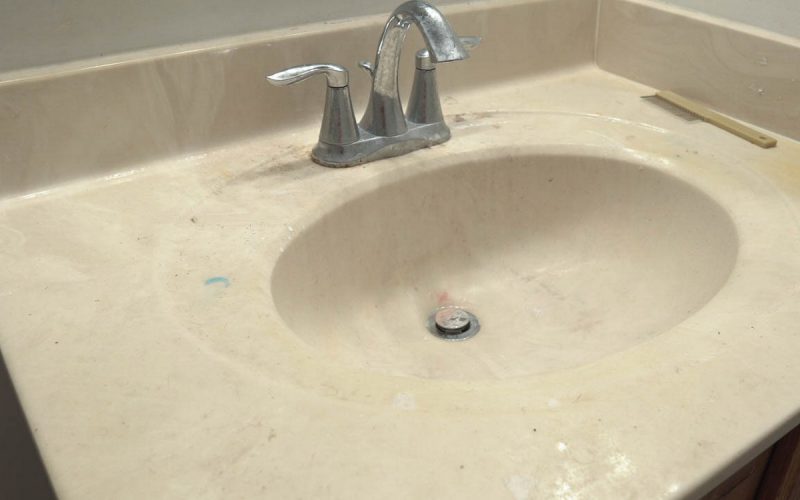
Image resolution: width=800 pixels, height=500 pixels. In order to click on back wall in this screenshot , I will do `click(134, 13)`.